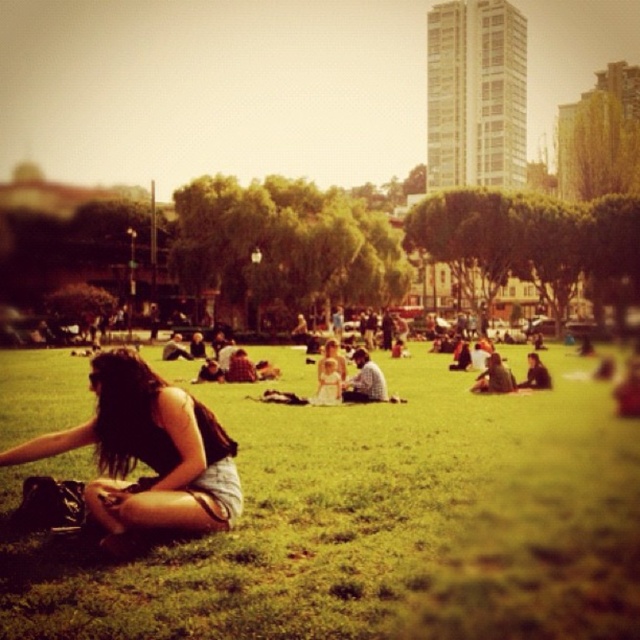
What do you see at coordinates (372, 524) in the screenshot? The height and width of the screenshot is (640, 640). I see `green grassy field at lower left` at bounding box center [372, 524].

Between green grassy field at lower left and matte black tank top at lower left, which one appears on the right side from the viewer's perspective?

Positioned to the right is green grassy field at lower left.

This screenshot has width=640, height=640. What do you see at coordinates (372, 524) in the screenshot?
I see `green grassy field at lower left` at bounding box center [372, 524].

At what (x,y) coordinates should I click in order to perform the action: click on green grassy field at lower left. Please return your answer as a coordinate pair (x, y). Looking at the image, I should click on (372, 524).

Is green grassy field at lower left closer to camera compared to light blue denim jeans at center?

Yes, it is in front of light blue denim jeans at center.

Who is positioned more to the right, green grassy field at lower left or light blue denim jeans at center?

light blue denim jeans at center is more to the right.

Who is more distant from viewer, (564, 433) or (369, 388)?

The point (369, 388) is behind.

In order to click on green grassy field at lower left in this screenshot , I will do `click(372, 524)`.

How far apart are matte black tank top at lower left and light blue denim jeans at center?

A distance of 22.20 meters exists between matte black tank top at lower left and light blue denim jeans at center.

Does matte black tank top at lower left come in front of light blue denim jeans at center?

Yes, matte black tank top at lower left is in front of light blue denim jeans at center.

Which is behind, point (22, 518) or point (364, 380)?

The point (364, 380) is more distant.

This screenshot has height=640, width=640. In order to click on matte black tank top at lower left in this screenshot , I will do pos(134,461).